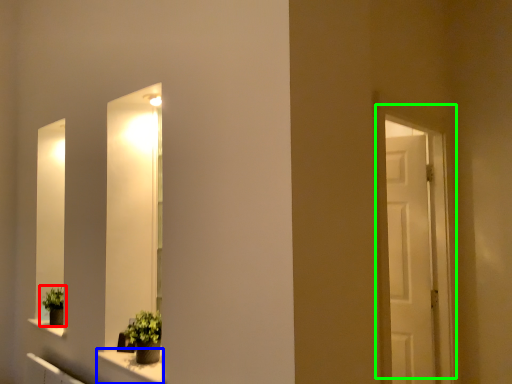
Question: Which is nearer to the houseplant (highlighted by a red box)? window sill (highlighted by a blue box) or door (highlighted by a green box).

Choices:
 (A) window sill
 (B) door

Answer: (A)